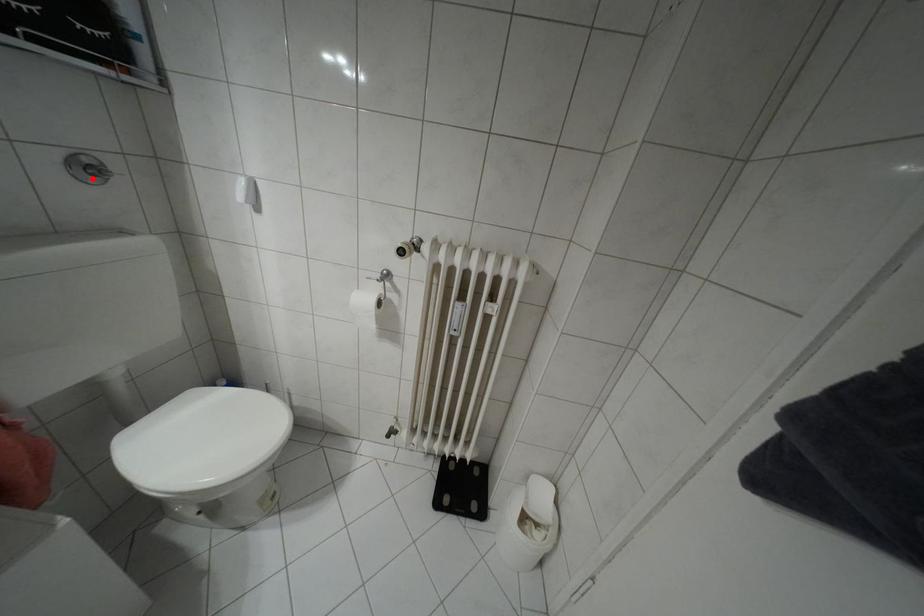
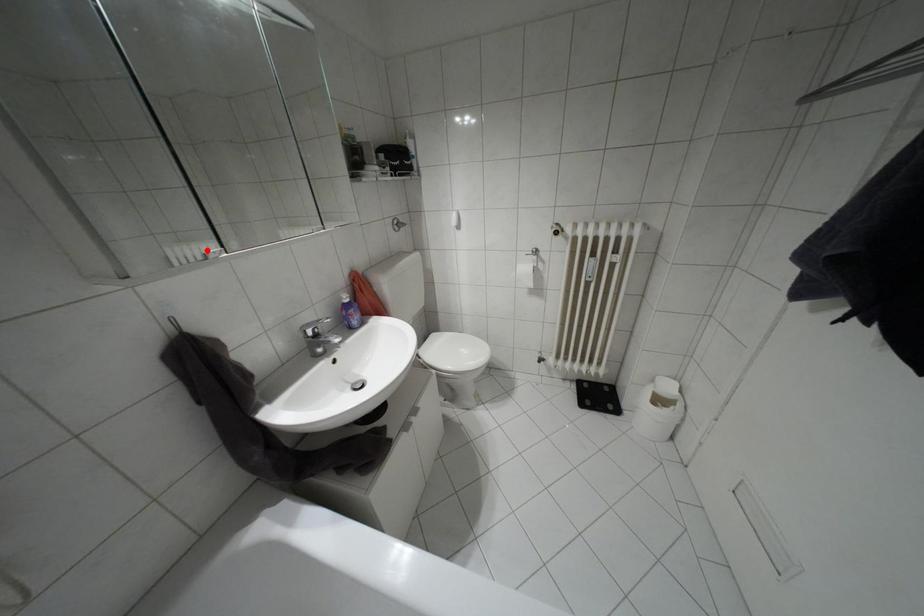
I am providing you with two images of the same scene from different viewpoints. A red point is marked on the first image and another point is marked on the second image. Is the marked point in image1 the same physical position as the marked point in image2?

No